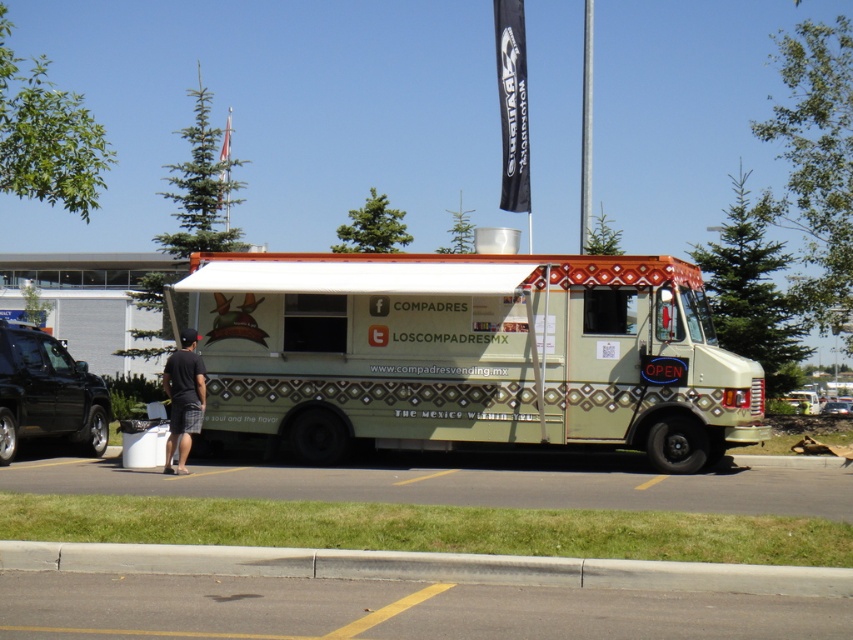
You are a delivery person trying to unload a box that requires placing it on a surface higher than 2 feet. Looking at the image, can you use either the gray concrete curb at lower center or the silver metallic pole at center as a surface? Explain your reasoning based on their heights.

The gray concrete curb at lower center has a lesser height compared to the silver metallic pole at center. Since the curb is shorter, only the silver metallic pole at center meets the height requirement of over 2 feet, so you can use the silver metallic pole at center.